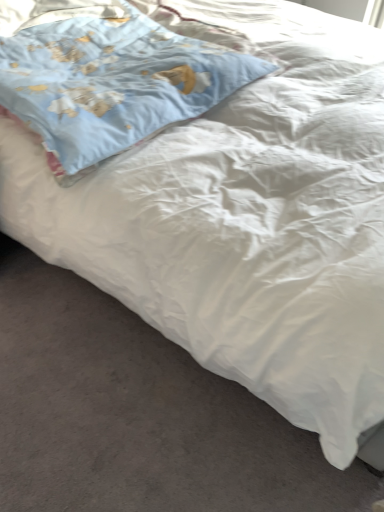
Question: Should I look upward or downward to see light blue fabric pillow at upper left?

Choices:
 (A) down
 (B) up

Answer: (B)